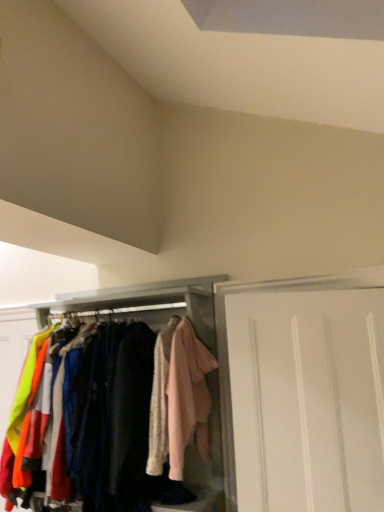
Question: Is light pink fabric at center aimed at white matte cabinet at center?

Choices:
 (A) no
 (B) yes

Answer: (B)

Question: From a real-world perspective, is light pink fabric at center located beneath white matte cabinet at center?

Choices:
 (A) yes
 (B) no

Answer: (B)

Question: Is light pink fabric at center behind white matte cabinet at center?

Choices:
 (A) yes
 (B) no

Answer: (B)

Question: Is light pink fabric at center at the left side of white matte cabinet at center?

Choices:
 (A) no
 (B) yes

Answer: (A)

Question: Is light pink fabric at center taller than white matte cabinet at center?

Choices:
 (A) no
 (B) yes

Answer: (A)

Question: Does light pink fabric at center have a lesser height compared to white matte cabinet at center?

Choices:
 (A) yes
 (B) no

Answer: (A)

Question: Does white matte cabinet at center come in front of white matte door at right?

Choices:
 (A) no
 (B) yes

Answer: (A)

Question: Can white matte door at right be found inside white matte cabinet at center?

Choices:
 (A) yes
 (B) no

Answer: (B)

Question: Is white matte cabinet at center looking in the opposite direction of white matte door at right?

Choices:
 (A) no
 (B) yes

Answer: (A)

Question: From a real-world perspective, is white matte cabinet at center located higher than white matte door at right?

Choices:
 (A) no
 (B) yes

Answer: (A)

Question: Does white matte cabinet at center have a greater width compared to white matte door at right?

Choices:
 (A) no
 (B) yes

Answer: (B)

Question: Does white matte cabinet at center turn towards white matte door at right?

Choices:
 (A) no
 (B) yes

Answer: (A)

Question: Is light pink fabric at center a part of white matte cabinet at center?

Choices:
 (A) no
 (B) yes

Answer: (B)